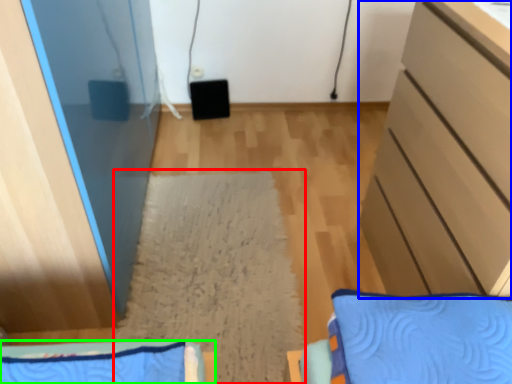
Question: Which is farther away from mat (highlighted by a red box)? cabinetry (highlighted by a blue box) or furniture (highlighted by a green box)?

Choices:
 (A) cabinetry
 (B) furniture

Answer: (A)